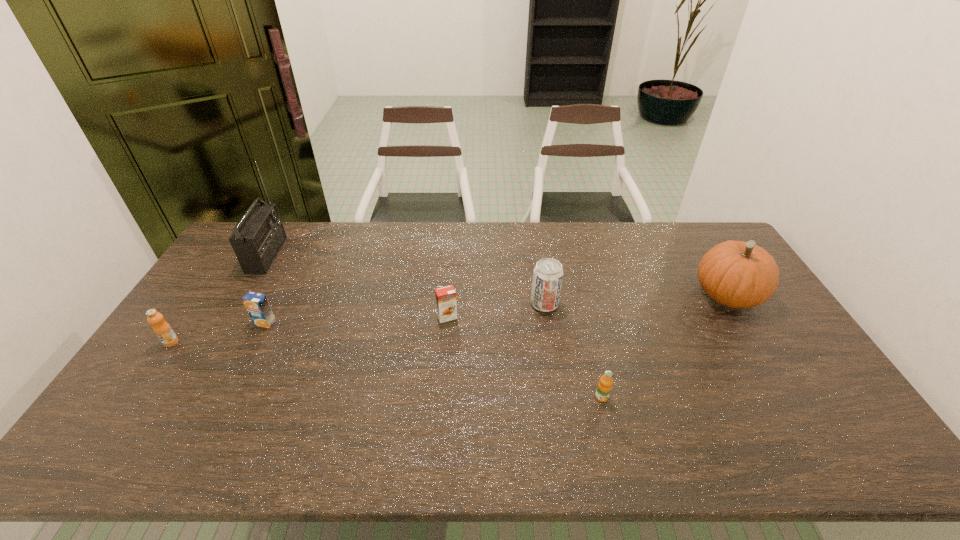
The image size is (960, 540). In order to click on free space located 0.140m on the label of the sixth object from left to right in this screenshot , I will do `click(615, 455)`.

The width and height of the screenshot is (960, 540). In order to click on object that is at the far edge in this screenshot , I will do `click(257, 238)`.

The height and width of the screenshot is (540, 960). Identify the location of radio receiver at the left edge. (257, 238).

Locate an element on the screen. The height and width of the screenshot is (540, 960). orange juice present at the left edge is located at coordinates (161, 328).

At what (x,y) coordinates should I click in order to perform the action: click on object situated at the right edge. Please return your answer as a coordinate pair (x, y). The image size is (960, 540). Looking at the image, I should click on (736, 274).

At what (x,y) coordinates should I click in order to perform the action: click on object that is at the far left corner. Please return your answer as a coordinate pair (x, y). This screenshot has width=960, height=540. Looking at the image, I should click on (257, 238).

Locate an element on the screen. The width and height of the screenshot is (960, 540). vacant space at the far edge is located at coordinates (487, 256).

This screenshot has height=540, width=960. I want to click on free spot at the near edge of the desktop, so pyautogui.click(x=526, y=458).

In order to click on vacant space at the left edge in this screenshot , I will do `click(145, 394)`.

At what (x,y) coordinates should I click in order to perform the action: click on free space at the right edge. Please return your answer as a coordinate pair (x, y). The height and width of the screenshot is (540, 960). Looking at the image, I should click on (745, 314).